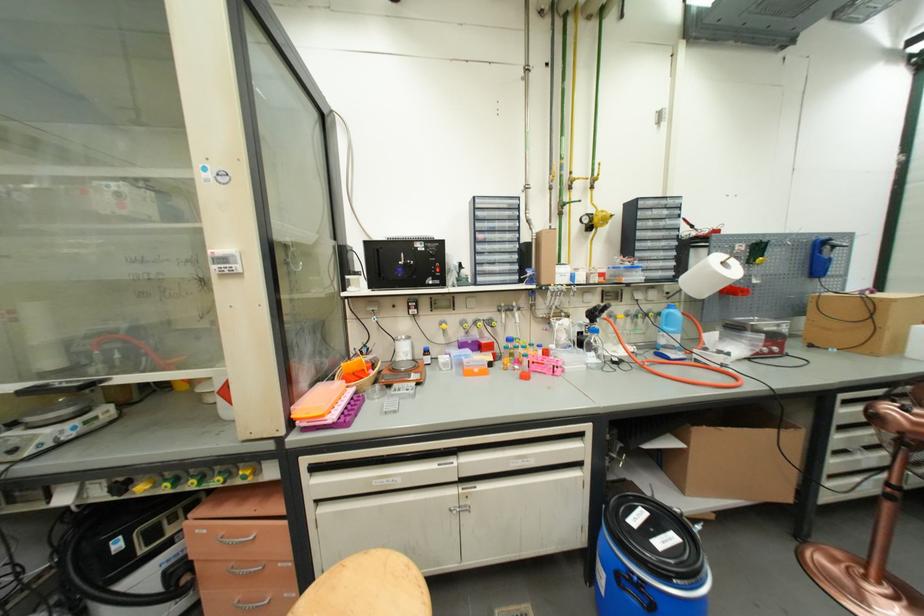
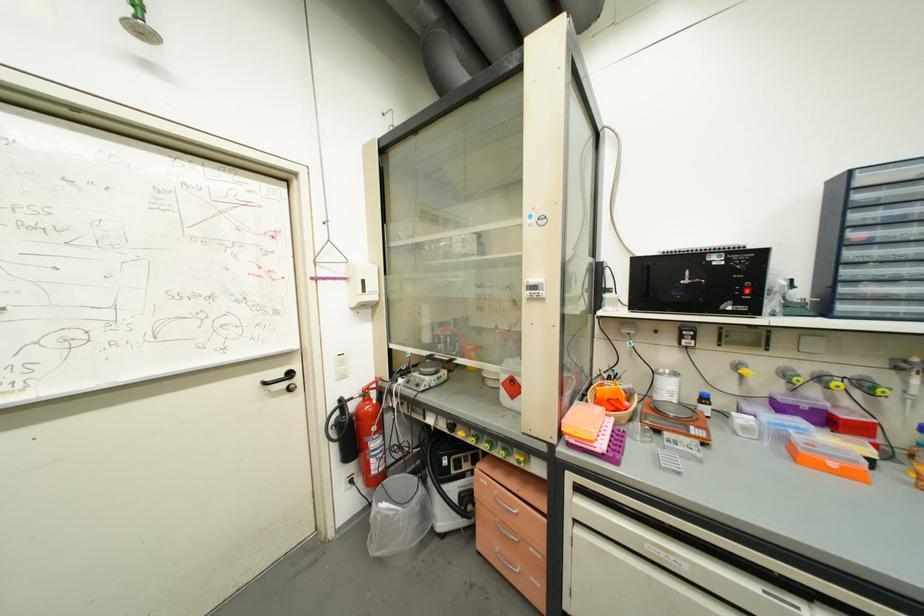
Locate, in the second image, the point that corresponds to the point at 227,544 in the first image.

(502, 503)